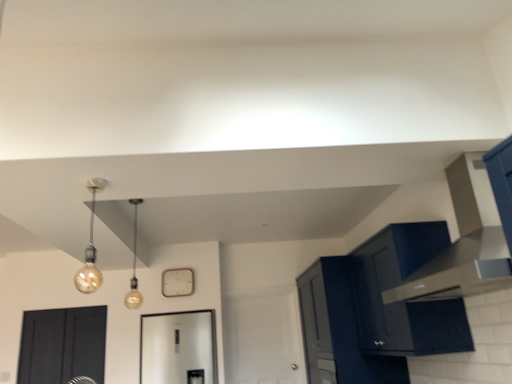
Question: From the image's perspective, relative to matte gold bulb at upper left, the 2th light fixture positioned from the back, is matte glass bulb at center, marked as the 2th light fixture in a front-to-back arrangement, above or below?

Choices:
 (A) above
 (B) below

Answer: (B)

Question: Based on their sizes in the image, would you say matte glass bulb at center, marked as the 2th light fixture in a front-to-back arrangement, is bigger or smaller than matte gold bulb at upper left, the 2th light fixture positioned from the back?

Choices:
 (A) big
 (B) small

Answer: (A)

Question: Which object is the farthest from the matte black vent at upper right?

Choices:
 (A) matte gold bulb at upper left, the 2th light fixture positioned from the back
 (B) matte dark blue cabinet at upper right, which is the 1th cabinetry from back to front
 (C) matte black door at lower left, which is the second door in right-to-left order
 (D) matte glass bulb at center, marked as the 2th light fixture in a front-to-back arrangement
 (E) matte black cabinet at right, the first cabinetry when ordered from front to back

Answer: (A)

Question: Which object is positioned farthest from the matte glass bulb at center, marked as the 2th light fixture in a front-to-back arrangement?

Choices:
 (A) white matte door at center, which ranks as the 2th door in front-to-back order
 (B) matte dark blue cabinet at upper right, the second cabinetry viewed from the front
 (C) matte gold bulb at upper left, placed as the first light fixture when sorted from front to back
 (D) white matte clock at center
 (E) matte black vent at upper right

Answer: (E)